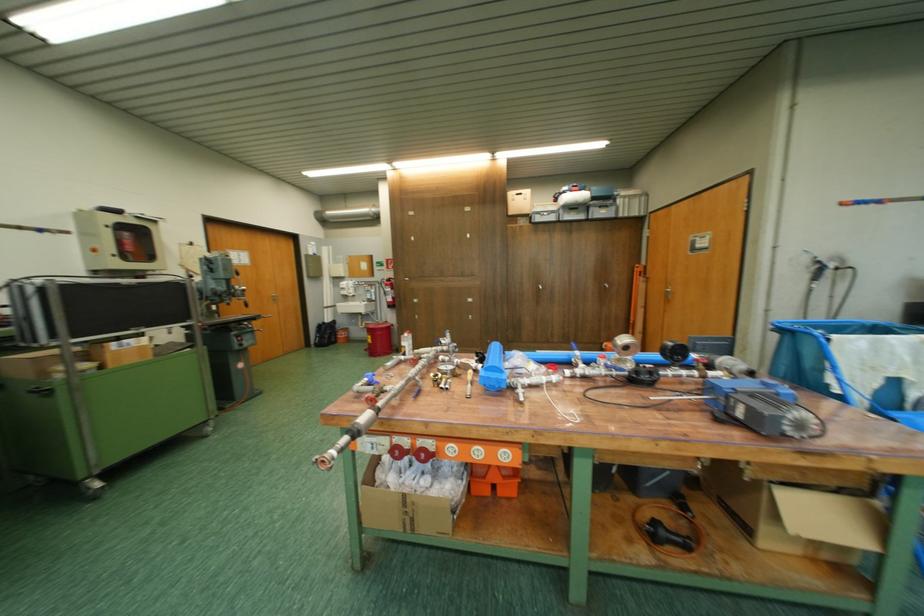
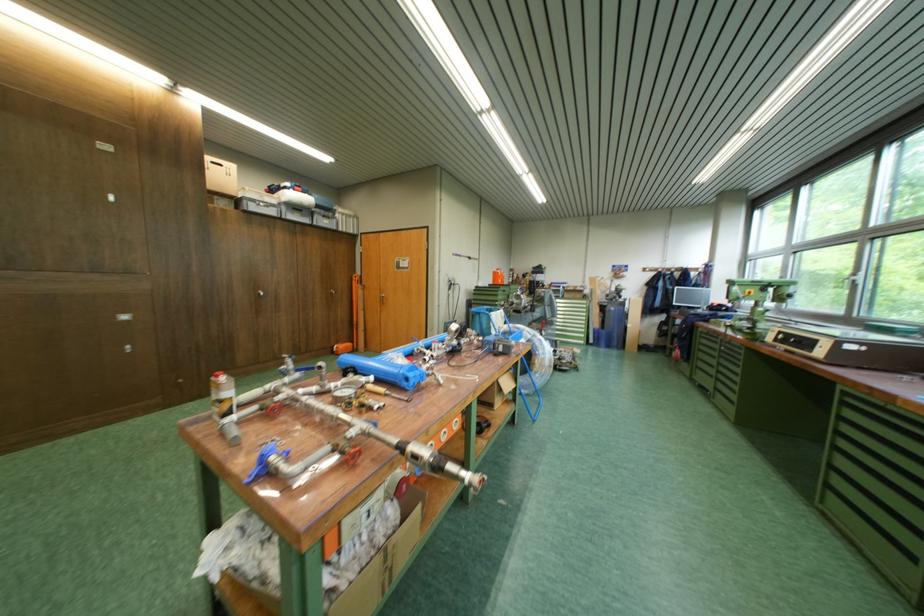
Where in the second image is the point corresponding to (615,347) from the first image?

(347, 350)